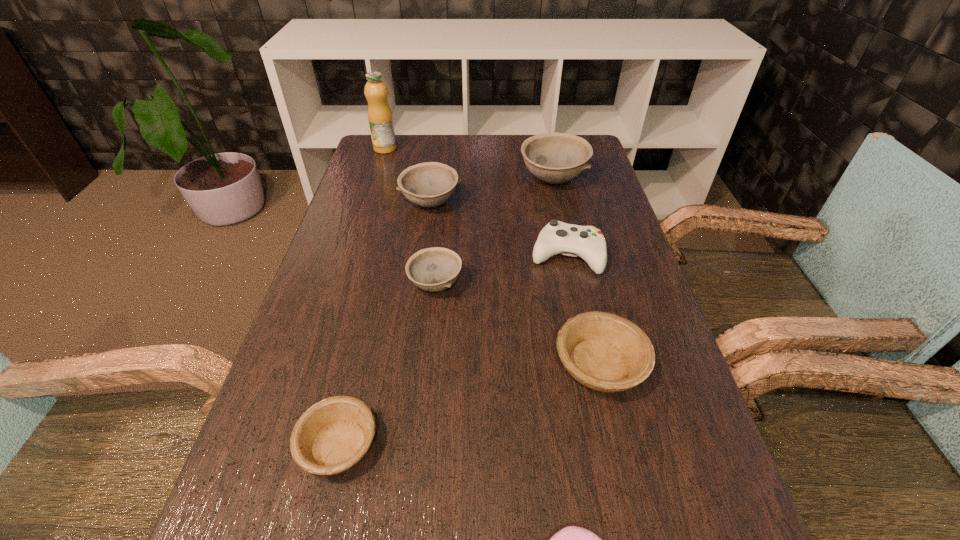
Find the location of `the tallest object`. the tallest object is located at coordinates (380, 118).

The height and width of the screenshot is (540, 960). Find the location of `fruit juice`. fruit juice is located at coordinates (380, 118).

You are a GUI agent. You are given a task and a screenshot of the screen. Output one action in this format:
    pyautogui.click(x=<x>, y=<y>)
    Task: Click on the second tallest object
    This screenshot has width=960, height=540.
    Given the screenshot: What is the action you would take?
    pyautogui.click(x=555, y=158)

You are a GUI agent. You are given a task and a screenshot of the screen. Output one action in this format:
    pyautogui.click(x=<x>, y=<y>)
    Task: Click on the biggest gray bowl
    This screenshot has height=540, width=960.
    Given the screenshot: What is the action you would take?
    pyautogui.click(x=555, y=158)

Where is `the third tallest object`? The height and width of the screenshot is (540, 960). the third tallest object is located at coordinates (430, 184).

The width and height of the screenshot is (960, 540). Identify the location of the second tallest bowl. coord(430,184).

Locate an element on the screen. The height and width of the screenshot is (540, 960). white control is located at coordinates (587, 242).

Where is `the third nearest bowl`? the third nearest bowl is located at coordinates (435, 269).

I want to click on the nearest gray bowl, so click(435, 269).

Locate an element on the screen. The image size is (960, 540). the farther beige bowl is located at coordinates (606, 352).